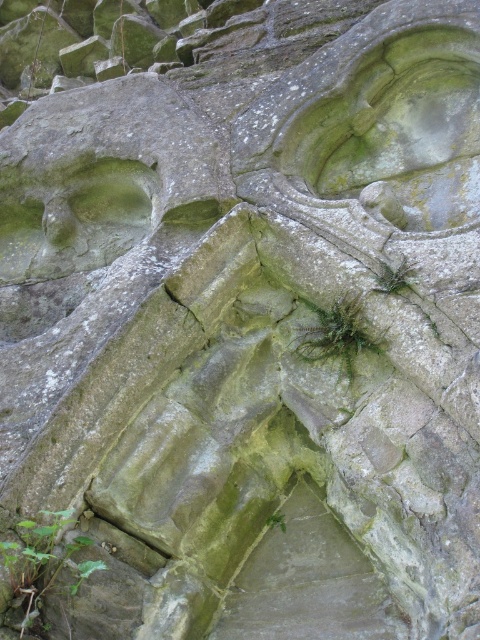
Question: Is green leafy plant at lower left below green leafy plant at center?

Choices:
 (A) yes
 (B) no

Answer: (A)

Question: Does green leafy plant at lower left have a larger size compared to green leafy plant at center?

Choices:
 (A) no
 (B) yes

Answer: (B)

Question: Considering the relative positions of green leafy plant at lower left and green leafy plant at center in the image provided, where is green leafy plant at lower left located with respect to green leafy plant at center?

Choices:
 (A) left
 (B) right

Answer: (A)